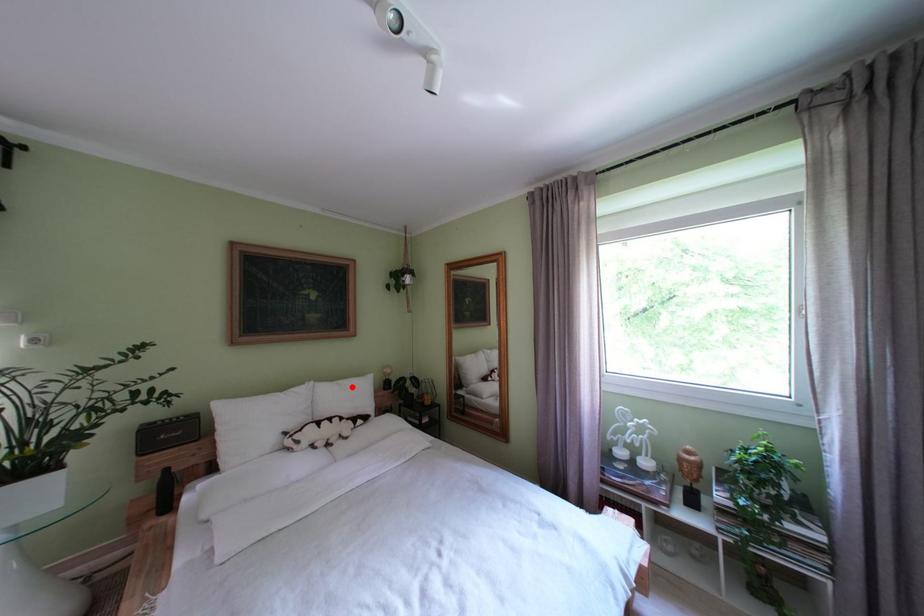
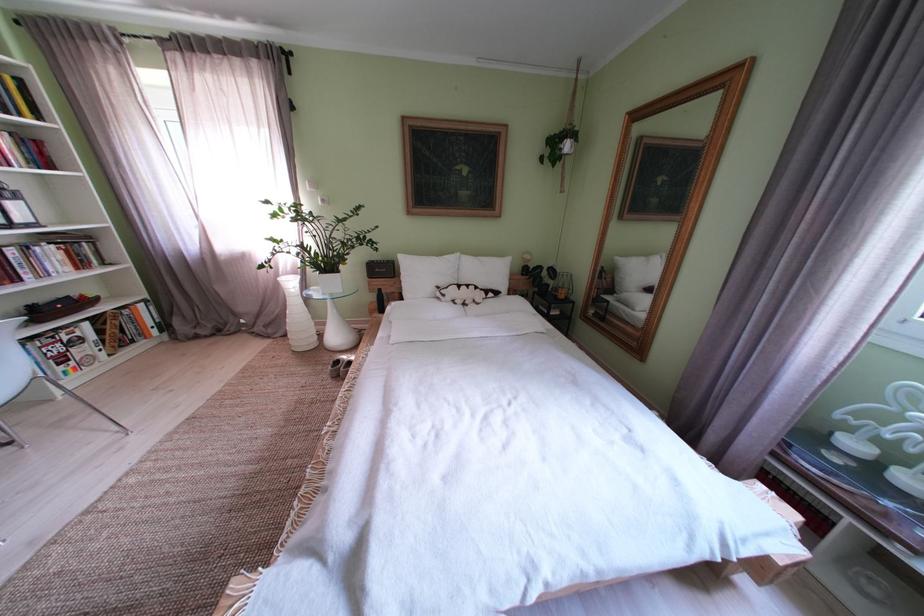
Question: A red point is marked in image1. In image2, is the corresponding 3D point closer to the camera or farther? Reply with the corresponding letter.

Choices:
 (A) The corresponding 3D point is closer.
 (B) The corresponding 3D point is farther.

Answer: (A)